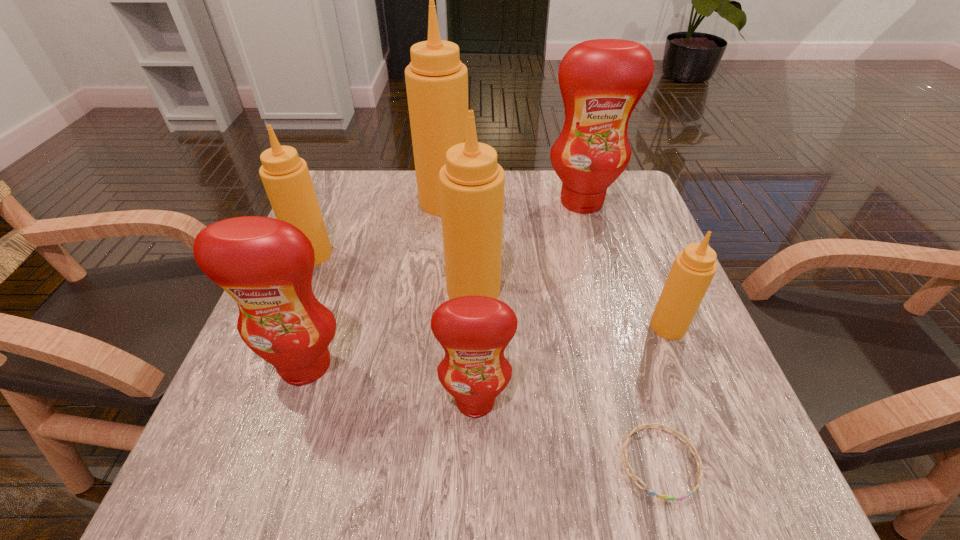
Locate an element on the screen. This screenshot has height=540, width=960. the fifth farthest condiment is located at coordinates (693, 269).

At what (x,y) coordinates should I click in order to perform the action: click on the smallest red condiment. Please return your answer as a coordinate pair (x, y). Looking at the image, I should click on (474, 331).

The image size is (960, 540). Find the location of `bracelet`. bracelet is located at coordinates (624, 450).

Where is `the nearest object`? the nearest object is located at coordinates (624, 450).

Where is `free spot located 0.130m on the front of the farthest tan condiment`? The width and height of the screenshot is (960, 540). free spot located 0.130m on the front of the farthest tan condiment is located at coordinates [x=440, y=251].

Locate an element on the screen. free location located 0.200m on the label side of the rightmost red condiment is located at coordinates (602, 272).

Locate an element on the screen. vacant space located on the left of the fourth farthest condiment is located at coordinates pyautogui.click(x=373, y=291).

Where is `vacant area situated 0.120m on the back of the third biggest tan condiment`? vacant area situated 0.120m on the back of the third biggest tan condiment is located at coordinates (330, 211).

Locate an element on the screen. The width and height of the screenshot is (960, 540). vacant space situated 0.060m on the label side of the second smallest red condiment is located at coordinates (286, 423).

Locate an element on the screen. The height and width of the screenshot is (540, 960). blank space located 0.230m on the left of the nearest tan condiment is located at coordinates tap(528, 326).